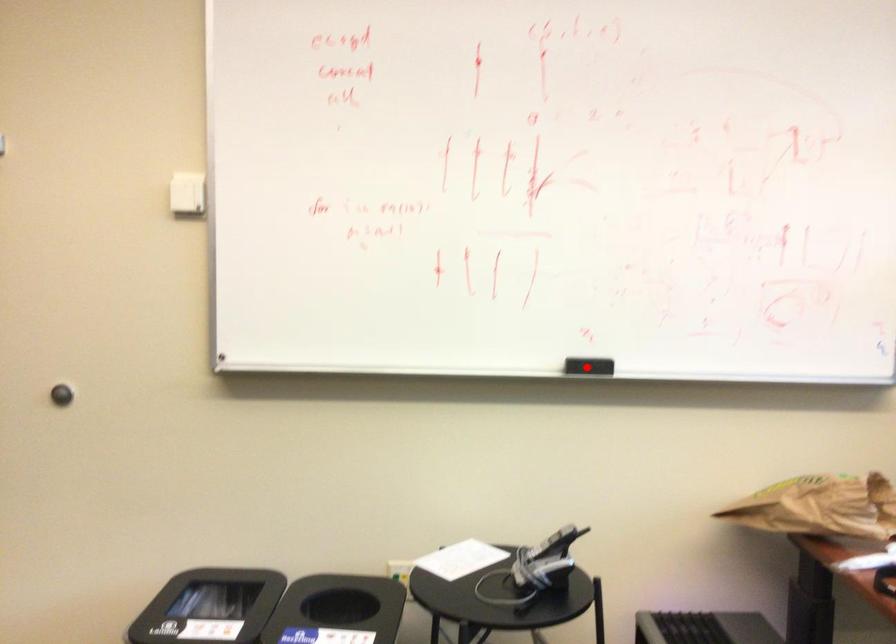
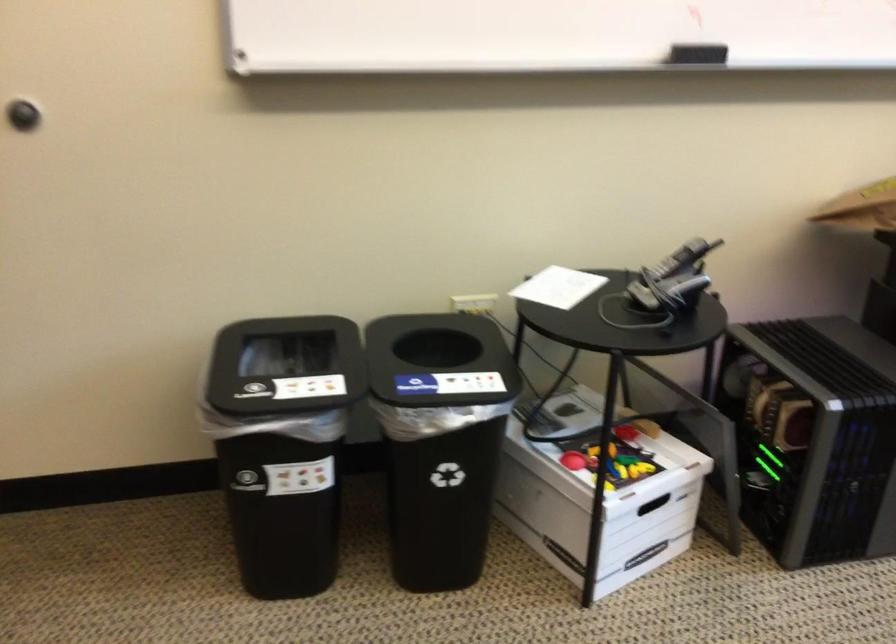
Question: I am providing you with two images of the same scene from different viewpoints. A red point is shown in image1. For the corresponding object point in image2, is it positioned nearer or farther from the camera?

Choices:
 (A) Nearer
 (B) Farther

Answer: (A)